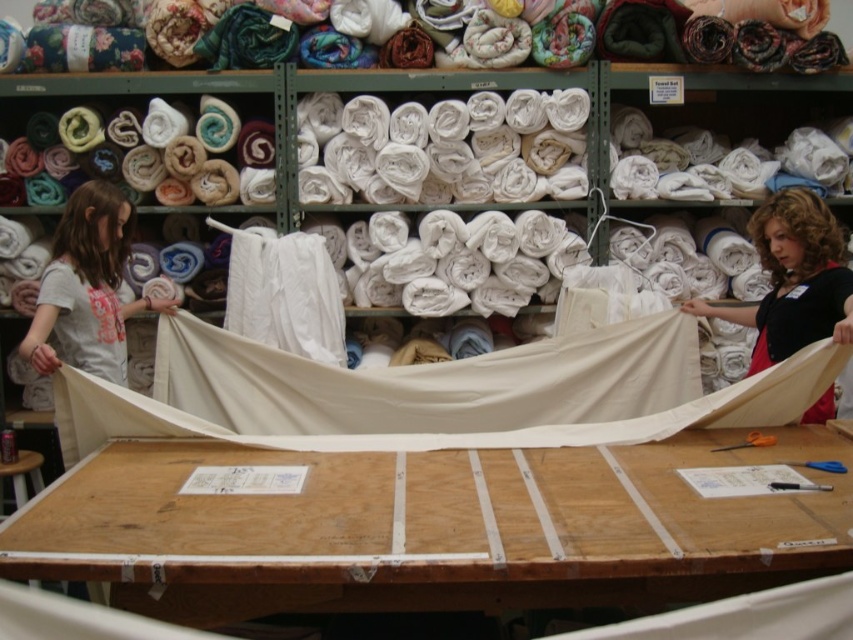
Is wooden table at center taller than matte black shirt at upper right?

No.

Is wooden table at center positioned at the back of matte black shirt at upper right?

No, it is in front of matte black shirt at upper right.

I want to click on wooden table at center, so click(434, 529).

Where is `wooden table at center`? wooden table at center is located at coordinates (434, 529).